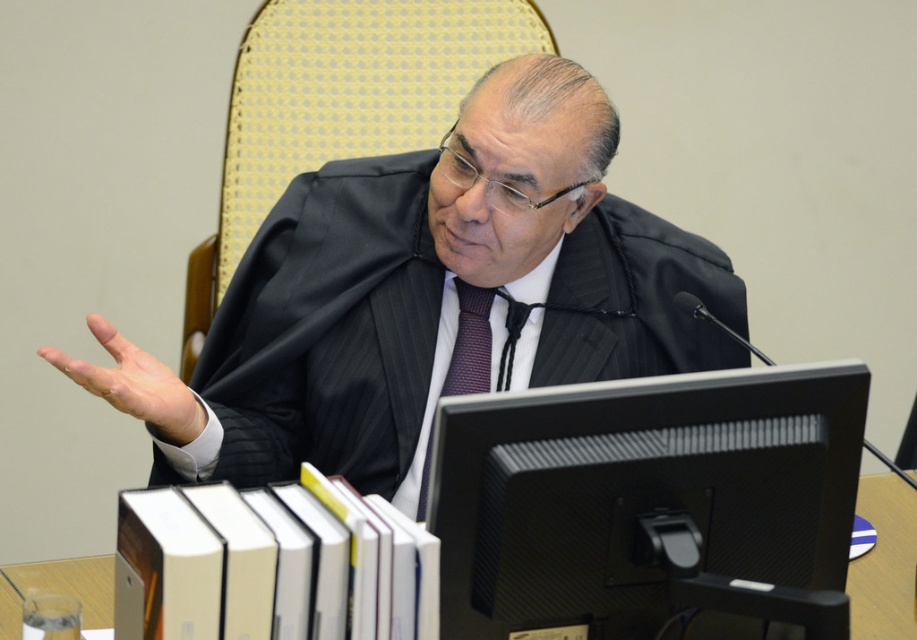
Question: From the image, what is the correct spatial relationship of black matte computer monitor at center in relation to striped fabric tie at center?

Choices:
 (A) right
 (B) left

Answer: (A)

Question: Estimate the real-world distances between objects in this image. Which object is closer to the striped fabric tie at center?

Choices:
 (A) black matte computer monitor at center
 (B) black pinstripe suit at center

Answer: (B)

Question: Estimate the real-world distances between objects in this image. Which object is farther from the striped fabric tie at center?

Choices:
 (A) black pinstripe suit at center
 (B) white paper at lower center

Answer: (B)

Question: Which object appears closest to the camera in this image?

Choices:
 (A) white paper at lower center
 (B) black matte computer monitor at center
 (C) striped fabric tie at center
 (D) black pinstripe suit at center

Answer: (B)

Question: In this image, where is black matte computer monitor at center located relative to striped fabric tie at center?

Choices:
 (A) above
 (B) below

Answer: (B)

Question: Where is black pinstripe suit at center located in relation to striped fabric tie at center in the image?

Choices:
 (A) right
 (B) left

Answer: (B)